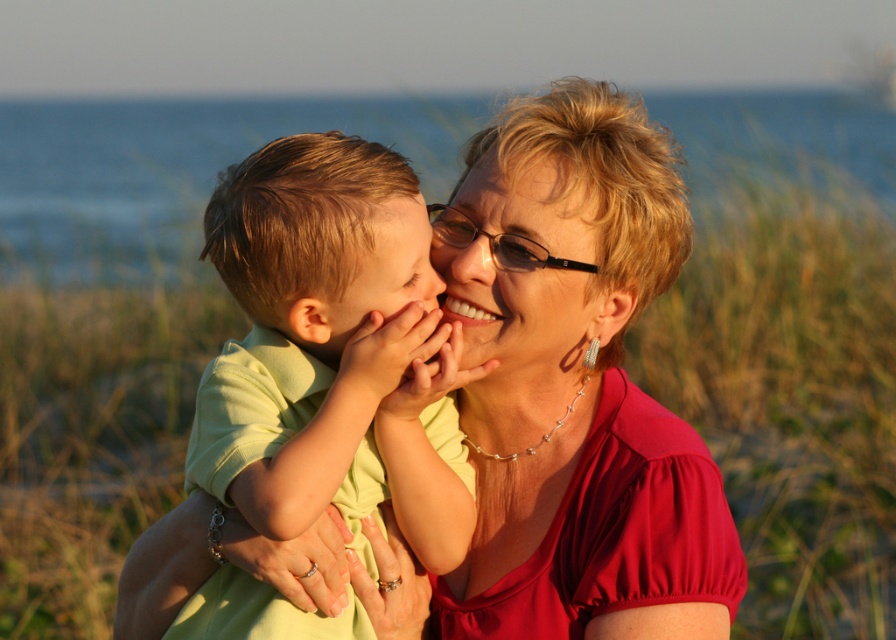
Question: Which of the following is the closest to the observer?

Choices:
 (A) [194, 240]
 (B) [399, 291]

Answer: (B)

Question: Can you confirm if light green cotton shirt at center is positioned to the left of smooth skin face at center?

Choices:
 (A) yes
 (B) no

Answer: (A)

Question: Estimate the real-world distances between objects in this image. Which object is closer to the light green cotton shirt at center?

Choices:
 (A) matte black glasses at center
 (B) matte red blouse at center

Answer: (B)

Question: Is smooth skin face at center positioned at the back of smooth blonde hair at upper center?

Choices:
 (A) no
 (B) yes

Answer: (A)

Question: Is matte red blouse at center above smooth skin face at center?

Choices:
 (A) no
 (B) yes

Answer: (A)

Question: Which point is closer to the camera taking this photo?

Choices:
 (A) (302, 545)
 (B) (412, 134)
 (C) (590, 188)
 (D) (352, 180)

Answer: (A)